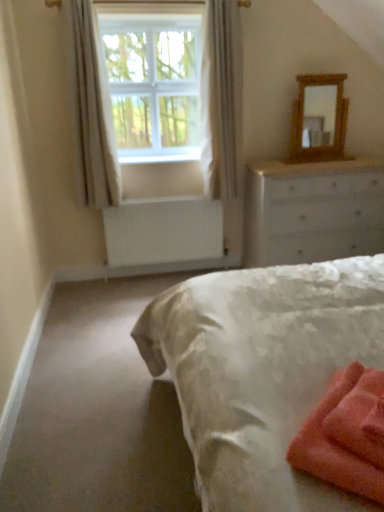
Question: Considering the relative positions of white sheer curtain at upper left, which is counted as the second curtain, starting from the left, and white plastic window screen at upper center in the image provided, is white sheer curtain at upper left, which is counted as the second curtain, starting from the left, to the right of white plastic window screen at upper center from the viewer's perspective?

Choices:
 (A) no
 (B) yes

Answer: (B)

Question: From the image's perspective, would you say white sheer curtain at upper left, which is counted as the second curtain, starting from the left, is positioned over white plastic window screen at upper center?

Choices:
 (A) yes
 (B) no

Answer: (B)

Question: Is white sheer curtain at upper left, which is counted as the second curtain, starting from the left, looking in the opposite direction of white plastic window screen at upper center?

Choices:
 (A) no
 (B) yes

Answer: (A)

Question: Is white plastic window screen at upper center inside white sheer curtain at upper left, marked as the 1th curtain in a right-to-left arrangement?

Choices:
 (A) yes
 (B) no

Answer: (B)

Question: Considering the relative sizes of white sheer curtain at upper left, marked as the 1th curtain in a right-to-left arrangement, and white plastic window screen at upper center in the image provided, is white sheer curtain at upper left, marked as the 1th curtain in a right-to-left arrangement, taller than white plastic window screen at upper center?

Choices:
 (A) no
 (B) yes

Answer: (B)

Question: Is white sheer curtain at upper left, which is counted as the second curtain, starting from the left, outside of white plastic window screen at upper center?

Choices:
 (A) no
 (B) yes

Answer: (B)

Question: Can you confirm if white painted wood at lower center is smaller than wooden mirror at upper right?

Choices:
 (A) yes
 (B) no

Answer: (A)

Question: Does white painted wood at lower center have a greater width compared to wooden mirror at upper right?

Choices:
 (A) no
 (B) yes

Answer: (B)

Question: Is white painted wood at lower center bigger than wooden mirror at upper right?

Choices:
 (A) yes
 (B) no

Answer: (B)

Question: From a real-world perspective, is white painted wood at lower center located higher than wooden mirror at upper right?

Choices:
 (A) no
 (B) yes

Answer: (A)

Question: From the image's perspective, is white painted wood at lower center over wooden mirror at upper right?

Choices:
 (A) no
 (B) yes

Answer: (A)

Question: Is white painted wood at lower center oriented away from wooden mirror at upper right?

Choices:
 (A) no
 (B) yes

Answer: (A)

Question: From the image's perspective, is soft coral towel at lower right under white sheer curtain at upper left, arranged as the 1th curtain when viewed from the left?

Choices:
 (A) no
 (B) yes

Answer: (B)